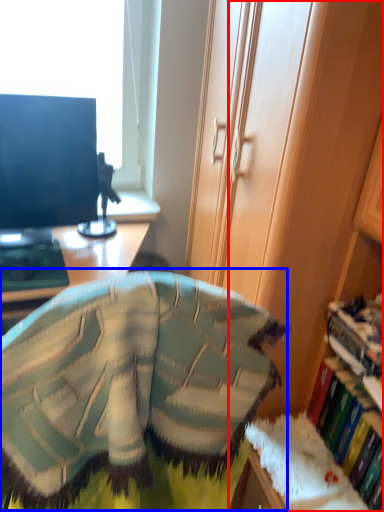
Question: Among these objects, which one is nearest to the camera, cabinetry (highlighted by a red box) or bean bag chair (highlighted by a blue box)?

Choices:
 (A) cabinetry
 (B) bean bag chair

Answer: (A)